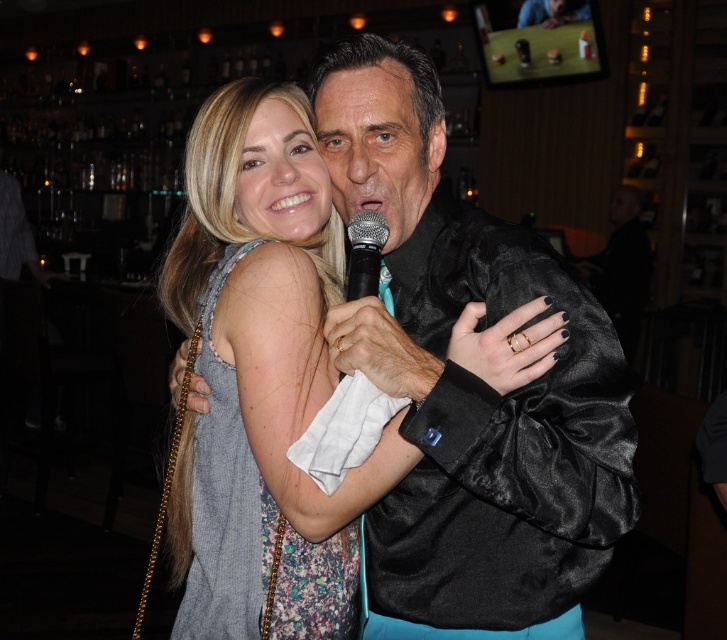
You are at a social event and need to decide which item is taking up more space horizontally between the satin black jacket at center and the floral fabric dress at center. Which one is wider?

The satin black jacket at center is wider than the floral fabric dress at center according to the description provided.

You are a photographer at the event and want to capture a photo of both the satin black jacket at center and the floral fabric dress at center. Which object should you focus on first if you want to include both in the frame without moving the camera?

The satin black jacket at center is positioned on the right side of the floral fabric dress at center, so you should focus on the floral fabric dress at center first to ensure both are in the frame.